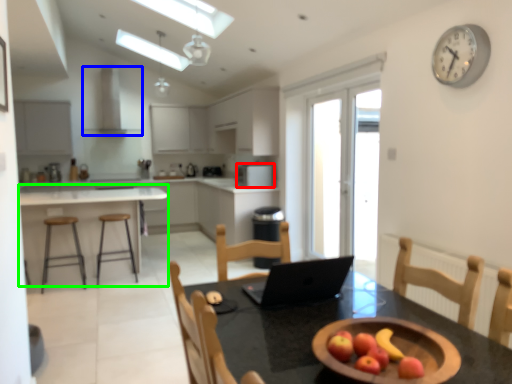
Question: Considering the real-world distances, which object is closest to kitchen appliance (highlighted by a red box)? exhaust hood (highlighted by a blue box) or table (highlighted by a green box).

Choices:
 (A) exhaust hood
 (B) table

Answer: (B)